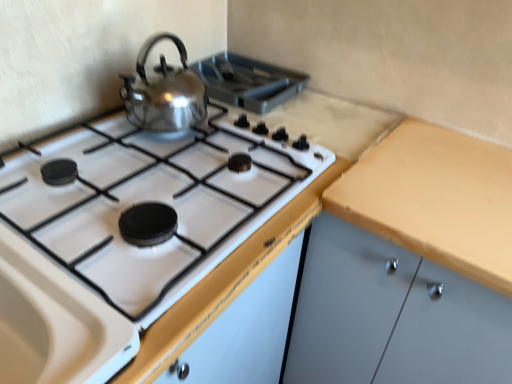
Describe the element at coordinates (248, 81) in the screenshot. I see `polished stainless steel kettle at upper center` at that location.

From the picture: What is the approximate height of matte wood cabinet at right?

matte wood cabinet at right is 85.84 centimeters in height.

This screenshot has height=384, width=512. Describe the element at coordinates (392, 316) in the screenshot. I see `matte wood cabinet at right` at that location.

The image size is (512, 384). I want to click on polished stainless steel kettle at upper center, so click(x=248, y=81).

Can you confirm if shiny metallic kettle at upper left is wider than matte wood cabinet at right?

No.

Is shiny metallic kettle at upper left further to the viewer compared to matte wood cabinet at right?

Yes, it is.

From the image's perspective, which is above, shiny metallic kettle at upper left or matte wood cabinet at right?

shiny metallic kettle at upper left.

Which is behind, point (148, 84) or point (318, 219)?

Positioned behind is point (318, 219).

Between point (414, 345) and point (269, 70), which one is positioned behind?

The point (269, 70) is farther from the camera.

Based on the photo, from a real-world perspective, between matte wood cabinet at right and polished stainless steel kettle at upper center, who is vertically higher?

polished stainless steel kettle at upper center.

Could you tell me if matte wood cabinet at right is turned towards polished stainless steel kettle at upper center?

No, matte wood cabinet at right is not aimed at polished stainless steel kettle at upper center.

Does matte wood cabinet at right appear on the left side of polished stainless steel kettle at upper center?

No, matte wood cabinet at right is not to the left of polished stainless steel kettle at upper center.

Looking at this image, from a real-world perspective, is shiny metallic kettle at upper left located higher than polished stainless steel kettle at upper center?

Yes, from a real-world perspective, shiny metallic kettle at upper left is on top of polished stainless steel kettle at upper center.

From the image's perspective, which one is positioned higher, shiny metallic kettle at upper left or polished stainless steel kettle at upper center?

polished stainless steel kettle at upper center, from the image's perspective.

Is shiny metallic kettle at upper left turned away from polished stainless steel kettle at upper center?

No, polished stainless steel kettle at upper center is not at the back of shiny metallic kettle at upper left.

Looking at their sizes, would you say shiny metallic kettle at upper left is wider or thinner than polished stainless steel kettle at upper center?

Considering their sizes, shiny metallic kettle at upper left looks slimmer than polished stainless steel kettle at upper center.

Find the location of a particular element. kitchen appliance that appears above the matte wood cabinet at right (from the image's perspective) is located at coordinates (164, 93).

From the image's perspective, is matte wood cabinet at right above or below shiny metallic kettle at upper left?

matte wood cabinet at right is below shiny metallic kettle at upper left.

Is matte wood cabinet at right outside of shiny metallic kettle at upper left?

Yes, matte wood cabinet at right is located beyond the bounds of shiny metallic kettle at upper left.

From the image's perspective, between polished stainless steel kettle at upper center and shiny metallic kettle at upper left, which one is located above?

From the image's view, polished stainless steel kettle at upper center is above.

In the scene shown: Can you confirm if polished stainless steel kettle at upper center is smaller than shiny metallic kettle at upper left?

Indeed, polished stainless steel kettle at upper center has a smaller size compared to shiny metallic kettle at upper left.

Which object is positioned more to the right, polished stainless steel kettle at upper center or shiny metallic kettle at upper left?

Positioned to the right is polished stainless steel kettle at upper center.

Consider the image. Is polished stainless steel kettle at upper center outside of shiny metallic kettle at upper left?

Yes, polished stainless steel kettle at upper center is located beyond the bounds of shiny metallic kettle at upper left.

Can we say polished stainless steel kettle at upper center lies outside matte wood cabinet at right?

Yes, polished stainless steel kettle at upper center is located beyond the bounds of matte wood cabinet at right.

Locate an element on the screen. appliance above the matte wood cabinet at right (from the image's perspective) is located at coordinates (248, 81).

Is matte wood cabinet at right at the back of polished stainless steel kettle at upper center?

No, polished stainless steel kettle at upper center is not facing the opposite direction of matte wood cabinet at right.

Does point (233, 73) come in front of point (396, 267)?

No, (233, 73) is further to viewer.

This screenshot has height=384, width=512. In order to click on kitchen appliance behind the matte wood cabinet at right in this screenshot , I will do `click(164, 93)`.

Locate an element on the screen. The image size is (512, 384). appliance above the matte wood cabinet at right (from the image's perspective) is located at coordinates (248, 81).

From the image, which object appears to be nearer to matte wood cabinet at right, shiny metallic kettle at upper left or polished stainless steel kettle at upper center?

shiny metallic kettle at upper left.

Which object lies further to the anchor point matte wood cabinet at right, polished stainless steel kettle at upper center or shiny metallic kettle at upper left?

polished stainless steel kettle at upper center lies further to matte wood cabinet at right than the other object.

Based on their spatial positions, is shiny metallic kettle at upper left or matte wood cabinet at right further from polished stainless steel kettle at upper center?

matte wood cabinet at right lies further to polished stainless steel kettle at upper center than the other object.

Looking at the image, which one is located further to shiny metallic kettle at upper left, matte wood cabinet at right or polished stainless steel kettle at upper center?

The object further to shiny metallic kettle at upper left is matte wood cabinet at right.

When comparing their distances from shiny metallic kettle at upper left, does polished stainless steel kettle at upper center or matte wood cabinet at right seem further?

Based on the image, matte wood cabinet at right appears to be further to shiny metallic kettle at upper left.

Looking at the image, which one is located further to polished stainless steel kettle at upper center, matte wood cabinet at right or shiny metallic kettle at upper left?

matte wood cabinet at right is further to polished stainless steel kettle at upper center.

I want to click on appliance situated between shiny metallic kettle at upper left and matte wood cabinet at right from left to right, so coord(248,81).